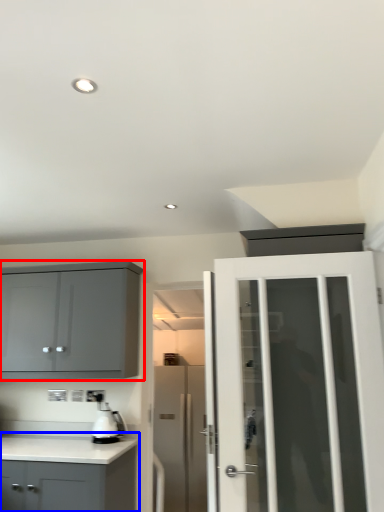
Question: Which of the following is the farthest to the observer, cabinetry (highlighted by a red box) or cabinetry (highlighted by a blue box)?

Choices:
 (A) cabinetry
 (B) cabinetry

Answer: (A)